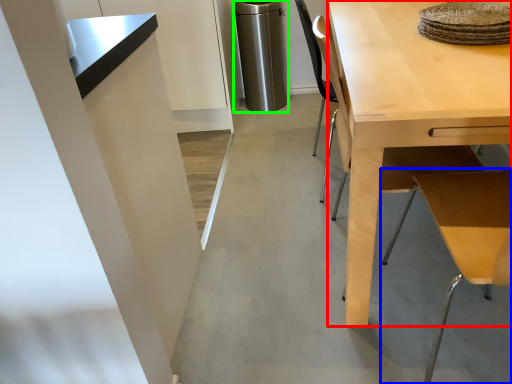
Question: Which is farther away from desk (highlighted by a red box)? table (highlighted by a blue box) or appliance (highlighted by a green box)?

Choices:
 (A) table
 (B) appliance

Answer: (B)